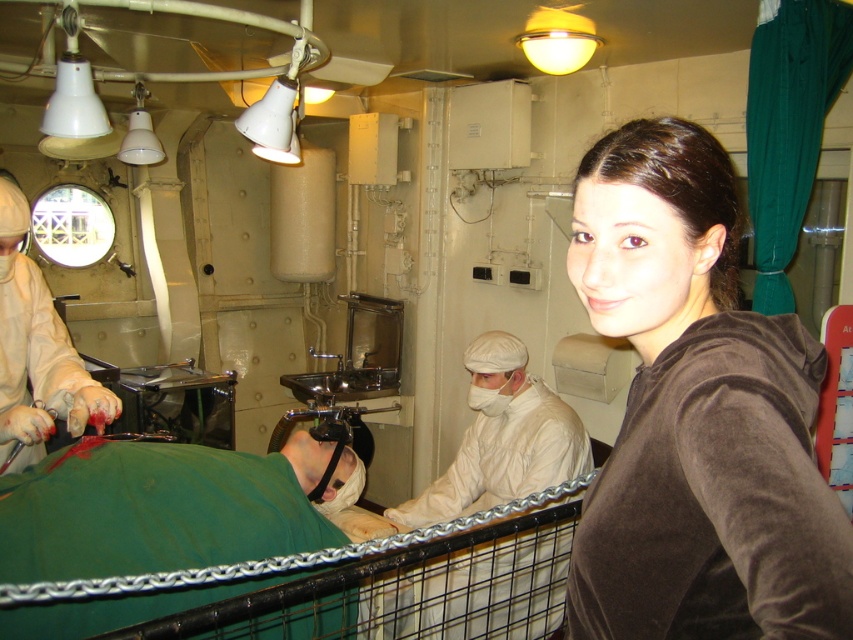
Question: Is white matte uniform at center behind white matte surgical gown at center?

Choices:
 (A) yes
 (B) no

Answer: (B)

Question: From the image, what is the correct spatial relationship of brown velvety shirt at upper right in relation to white matte surgical gown at center?

Choices:
 (A) left
 (B) right

Answer: (B)

Question: Among these points, which one is nearest to the camera?

Choices:
 (A) (663, 118)
 (B) (20, 260)

Answer: (A)

Question: Is brown velvety shirt at upper right below white matte surgical gown at center?

Choices:
 (A) yes
 (B) no

Answer: (A)

Question: Which object is the farthest from the white matte surgical gown at center?

Choices:
 (A) white matte uniform at center
 (B) brown velvety shirt at upper right

Answer: (B)

Question: Which point appears closest to the camera in this image?

Choices:
 (A) pyautogui.click(x=734, y=209)
 (B) pyautogui.click(x=502, y=390)

Answer: (A)